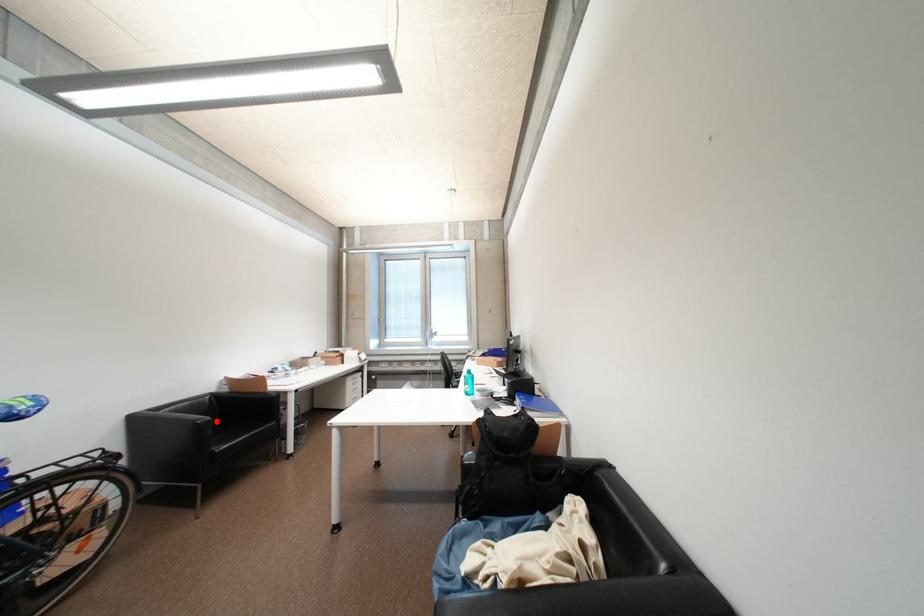
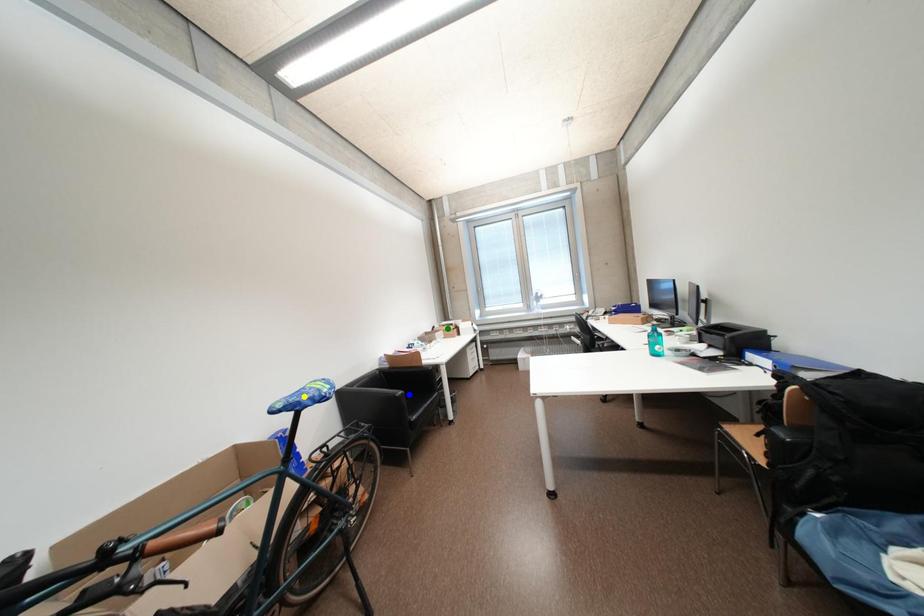
Question: I am providing you with two images of the same scene from different viewpoints. A red point is marked on the first image. You are given multiple points on the second image. In image 2, which mark is for the same physical point as the one in image 1?

Choices:
 (A) green point
 (B) yellow point
 (C) blue point

Answer: (C)